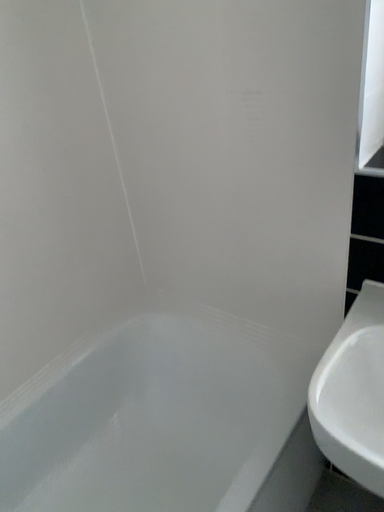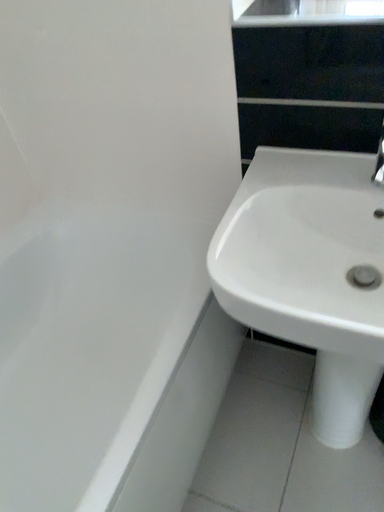
Question: Which way did the camera rotate in the video?

Choices:
 (A) rotated right
 (B) rotated left

Answer: (A)